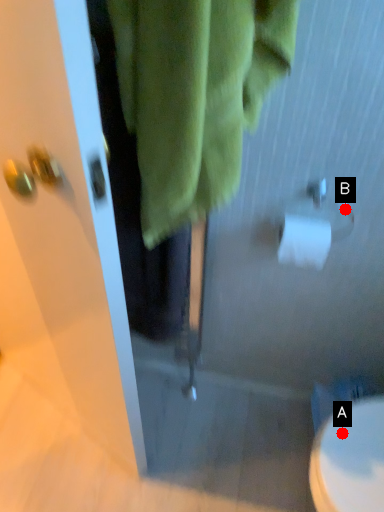
Question: Two points are circled on the image, labeled by A and B beside each circle. Which point appears closest to the camera in this image?

Choices:
 (A) A is closer
 (B) B is closer

Answer: (A)